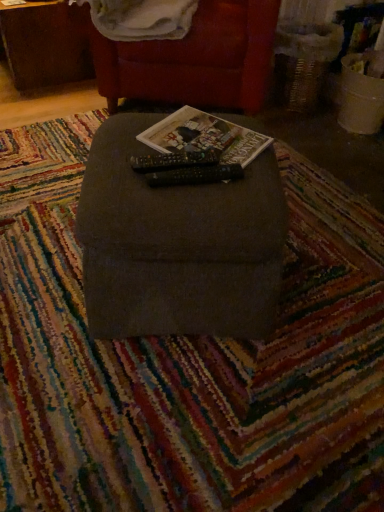
Question: Is dark gray fabric ottoman at center, which appears as the second furniture when viewed from the back, to the right of white soft blanket at upper center from the viewer's perspective?

Choices:
 (A) yes
 (B) no

Answer: (A)

Question: Is dark gray fabric ottoman at center, which appears as the second furniture when viewed from the back, outside white soft blanket at upper center?

Choices:
 (A) no
 (B) yes

Answer: (B)

Question: Can you confirm if dark gray fabric ottoman at center, the first furniture positioned from the front, is thinner than white soft blanket at upper center?

Choices:
 (A) no
 (B) yes

Answer: (B)

Question: From the image's perspective, would you say dark gray fabric ottoman at center, the first furniture in the bottom-to-top sequence, is shown under white soft blanket at upper center?

Choices:
 (A) yes
 (B) no

Answer: (A)

Question: Are dark gray fabric ottoman at center, which appears as the second furniture when viewed from the back, and white soft blanket at upper center far apart?

Choices:
 (A) no
 (B) yes

Answer: (A)

Question: Does point pos(216,193) appear closer or farther from the camera than point pos(56,10)?

Choices:
 (A) farther
 (B) closer

Answer: (B)

Question: From the image's perspective, is dark gray fabric ottoman at center, placed as the 2th furniture when sorted from top to bottom, above or below brown wood table at upper left?

Choices:
 (A) below
 (B) above

Answer: (A)

Question: Is dark gray fabric ottoman at center, placed as the 2th furniture when sorted from top to bottom, wider or thinner than brown wood table at upper left?

Choices:
 (A) wide
 (B) thin

Answer: (B)

Question: Is dark gray fabric ottoman at center, placed as the 2th furniture when sorted from top to bottom, in front of or behind brown wood table at upper left in the image?

Choices:
 (A) behind
 (B) front

Answer: (B)

Question: Would you say dark gray fabric ottoman at center, placed as the 2th furniture when sorted from top to bottom, is to the left or to the right of velvet red armchair at upper center, the 2th furniture from the front, in the picture?

Choices:
 (A) right
 (B) left

Answer: (B)

Question: Considering the positions of dark gray fabric ottoman at center, placed as the 2th furniture when sorted from top to bottom, and velvet red armchair at upper center, the 1th furniture viewed from the top, in the image, is dark gray fabric ottoman at center, placed as the 2th furniture when sorted from top to bottom, taller or shorter than velvet red armchair at upper center, the 1th furniture viewed from the top,?

Choices:
 (A) short
 (B) tall

Answer: (A)

Question: Is dark gray fabric ottoman at center, the first furniture in the bottom-to-top sequence, in front of or behind velvet red armchair at upper center, the 1th furniture viewed from the top, in the image?

Choices:
 (A) behind
 (B) front

Answer: (B)

Question: Looking at the image, does dark gray fabric ottoman at center, the first furniture positioned from the front, seem bigger or smaller compared to velvet red armchair at upper center, which appears as the 1th furniture when viewed from the back?

Choices:
 (A) big
 (B) small

Answer: (B)

Question: Considering the positions of point (82, 69) and point (102, 27), is point (82, 69) closer or farther from the camera than point (102, 27)?

Choices:
 (A) farther
 (B) closer

Answer: (A)

Question: Is brown wood table at upper left inside or outside of white soft blanket at upper center?

Choices:
 (A) inside
 (B) outside

Answer: (B)